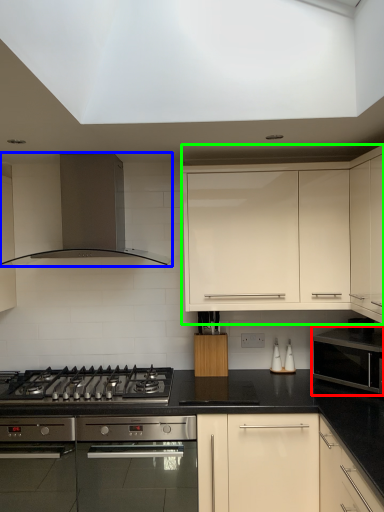
Question: Considering the real-world distances, which object is closest to microwave oven (highlighted by a red box)? kitchen appliance (highlighted by a blue box) or cabinetry (highlighted by a green box).

Choices:
 (A) kitchen appliance
 (B) cabinetry

Answer: (B)